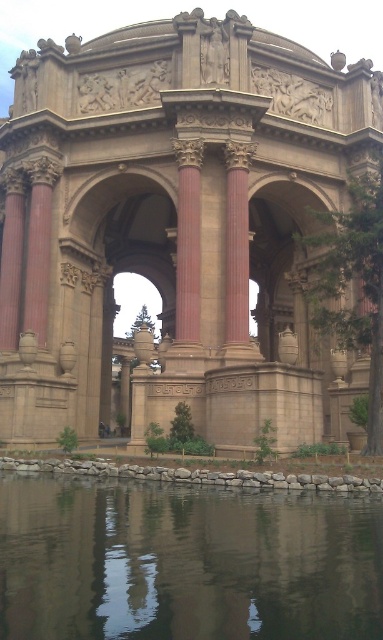
Is beige stone palace at center further to camera compared to transparent glass water at lower center?

Yes.

Does beige stone palace at center have a lesser width compared to transparent glass water at lower center?

No, beige stone palace at center is not thinner than transparent glass water at lower center.

Find the location of a particular element. beige stone palace at center is located at coordinates (176, 225).